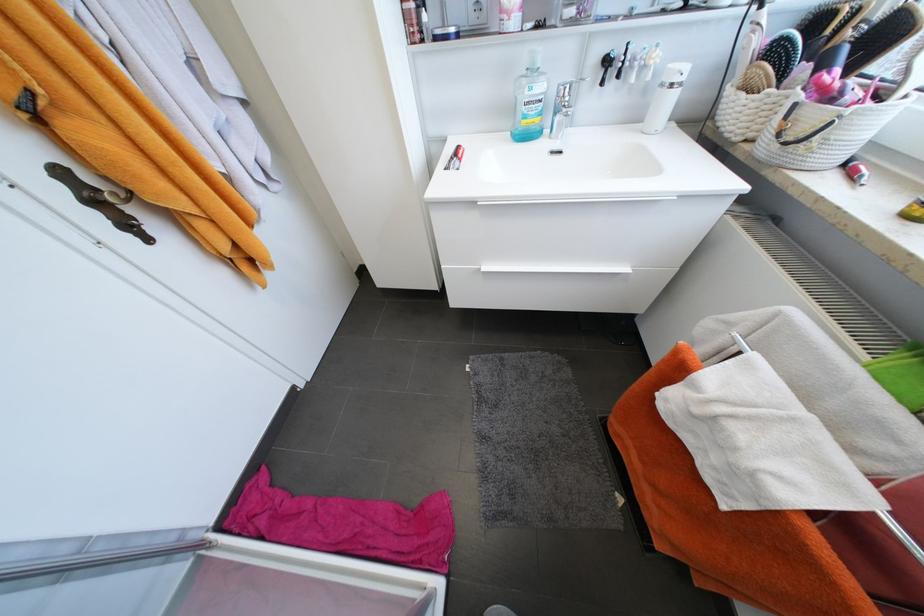
Find where to lift the faucet handle. Please return your answer as a coordinate pair (x, y).

(560, 122)